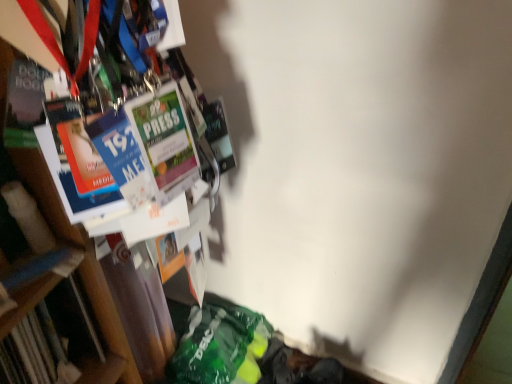
Question: From a real-world perspective, is wooden bookcase at left physically located above or below hardcover book at left?

Choices:
 (A) above
 (B) below

Answer: (A)

Question: Looking at their shapes, would you say wooden bookcase at left is wider or thinner than hardcover book at left?

Choices:
 (A) thin
 (B) wide

Answer: (B)

Question: From their relative heights in the image, would you say wooden bookcase at left is taller or shorter than hardcover book at left?

Choices:
 (A) tall
 (B) short

Answer: (A)

Question: In terms of height, does hardcover book at left look taller or shorter compared to wooden bookcase at left?

Choices:
 (A) tall
 (B) short

Answer: (B)

Question: Looking at the image, does hardcover book at left seem bigger or smaller compared to wooden bookcase at left?

Choices:
 (A) big
 (B) small

Answer: (B)

Question: Considering the positions of point 49,369 and point 58,316, is point 49,369 closer or farther from the camera than point 58,316?

Choices:
 (A) closer
 (B) farther

Answer: (B)

Question: From a real-world perspective, is hardcover book at left positioned above or below wooden bookcase at left?

Choices:
 (A) above
 (B) below

Answer: (B)